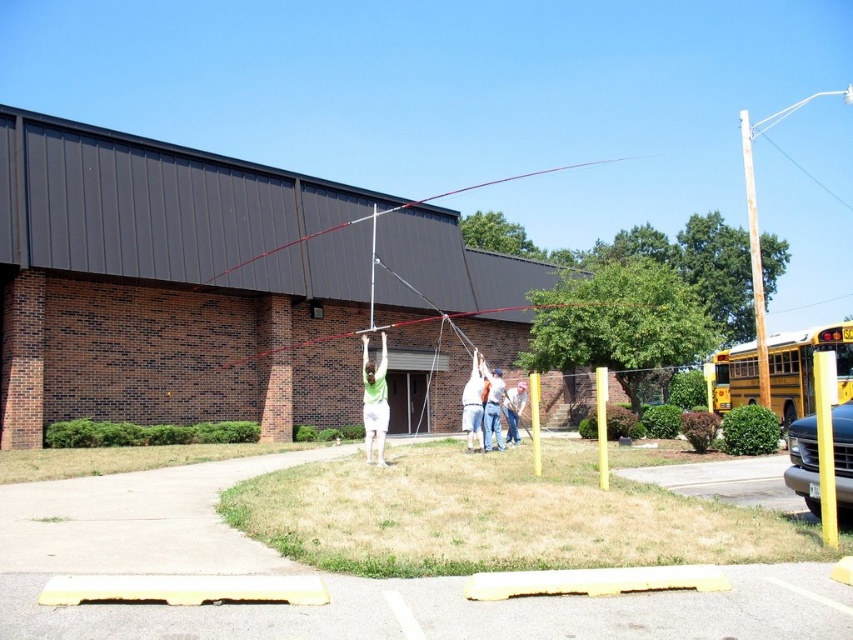
Question: Based on their relative distances, which object is farther from the metallic pole at center?

Choices:
 (A) red wire at upper center
 (B) white fabric at center
 (C) yellow painted metal pole at right

Answer: (C)

Question: In this image, where is white cotton shorts at center located relative to white fabric at center?

Choices:
 (A) left
 (B) right

Answer: (A)

Question: Which point is closer to the camera taking this photo?

Choices:
 (A) (370, 320)
 (B) (555, 172)
 (C) (366, 452)
 (D) (514, 394)

Answer: (C)

Question: Which object is the farthest from the brown wooden pole at right?

Choices:
 (A) denim pants at center
 (B) yellow painted metal pole at right
 (C) white cotton shirt at center

Answer: (C)

Question: Is red wire at upper center in front of brown wooden pole at right?

Choices:
 (A) no
 (B) yes

Answer: (A)

Question: Is white fabric at center above white cotton shirt at center?

Choices:
 (A) yes
 (B) no

Answer: (B)